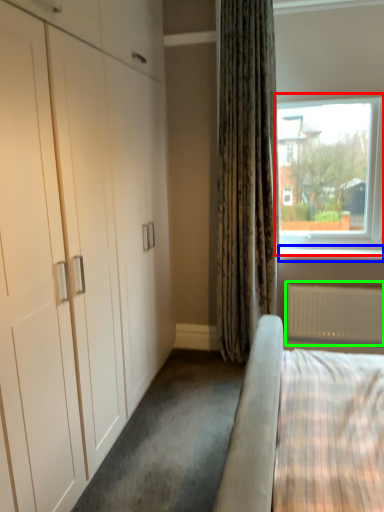
Question: Based on their relative distances, which object is farther from window (highlighted by a red box)? Choose from window sill (highlighted by a blue box) and radiator (highlighted by a green box).

Choices:
 (A) window sill
 (B) radiator

Answer: (B)